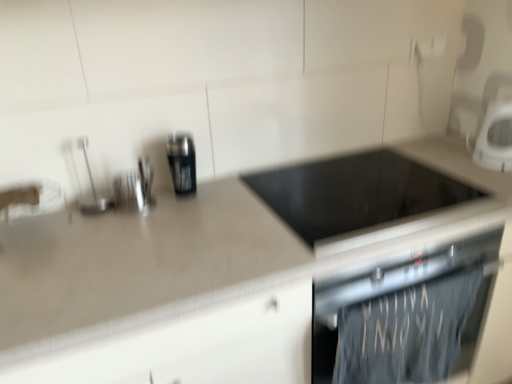
Find the location of `vacant space behind white glossy microwave at upper right, placed as the second kitchen appliance when sorted from left to right`. vacant space behind white glossy microwave at upper right, placed as the second kitchen appliance when sorted from left to right is located at coordinates (450, 145).